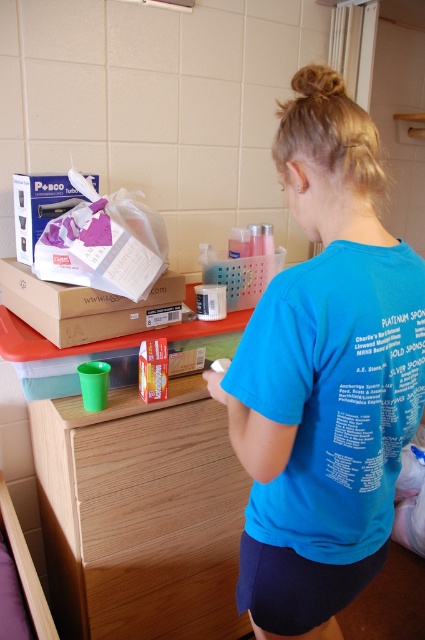
Question: Which point is farther from the camera taking this photo?

Choices:
 (A) (65, 317)
 (B) (121, 452)

Answer: (B)

Question: Is wooden drawer at lower center smaller than purple matte posco at upper left?

Choices:
 (A) yes
 (B) no

Answer: (B)

Question: Does wooden drawer at lower center appear on the right side of matte cardboard box at upper left?

Choices:
 (A) no
 (B) yes

Answer: (B)

Question: Is blue cotton shirt at center bigger than braided hair at upper center?

Choices:
 (A) yes
 (B) no

Answer: (A)

Question: Estimate the real-world distances between objects in this image. Which object is closer to the purple matte posco at upper left?

Choices:
 (A) matte cardboard box at upper left
 (B) braided hair at upper center

Answer: (A)

Question: Which object is positioned farthest from the purple matte posco at upper left?

Choices:
 (A) blue cotton shirt at center
 (B) braided hair at upper center
 (C) wooden drawer at lower center

Answer: (A)